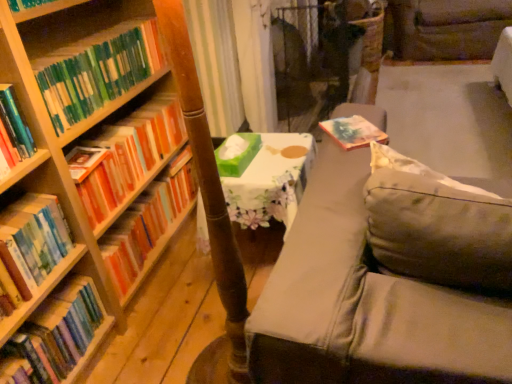
In order to face green matte tissue box at center, should I rotate leftwards or rightwards?

A 3.192 degree turn to the left will do.

What do you see at coordinates (86, 180) in the screenshot? Image resolution: width=512 pixels, height=384 pixels. I see `wooden bookcase at left` at bounding box center [86, 180].

What is the approximate height of orange matte bookshelf at left, which appears as the third book when ordered from the bottom?

25.70 centimeters.

Image resolution: width=512 pixels, height=384 pixels. In order to click on hardcover books at left, the fourth book when ordered from bottom to top in this screenshot , I will do `click(129, 154)`.

The image size is (512, 384). Describe the element at coordinates (365, 303) in the screenshot. I see `gray fabric couch at right` at that location.

I want to click on green matte tissue box at center, so click(x=237, y=155).

In the scene shown: Which object is positioned more to the left, gray fabric couch at right or green matte tissue box at center?

green matte tissue box at center.

Is gray fabric couch at right aimed at green matte tissue box at center?

No, gray fabric couch at right is not facing towards green matte tissue box at center.

From the image's perspective, is gray fabric couch at right under green matte tissue box at center?

Yes, from the image's perspective, gray fabric couch at right is beneath green matte tissue box at center.

In the image, is gray fabric couch at right positioned in front of or behind gray fabric swivel chair at upper right?

Visually, gray fabric couch at right is located in front of gray fabric swivel chair at upper right.

Image resolution: width=512 pixels, height=384 pixels. Find the location of `studio couch that appears above the gray fabric swivel chair at upper right (from a real-world perspective)`. studio couch that appears above the gray fabric swivel chair at upper right (from a real-world perspective) is located at coordinates (365, 303).

Is gray fabric couch at right beside gray fabric swivel chair at upper right?

There is a gap between gray fabric couch at right and gray fabric swivel chair at upper right.

Looking at this image, can gray fabric couch at right be found inside gray fabric swivel chair at upper right?

No, gray fabric couch at right is not a part of gray fabric swivel chair at upper right.

Considering the sizes of gray fabric swivel chair at upper right and gray fabric couch at right in the image, is gray fabric swivel chair at upper right taller or shorter than gray fabric couch at right?

In the image, gray fabric swivel chair at upper right appears to be shorter than gray fabric couch at right.

Which is in front, point (406, 14) or point (481, 356)?

Point (481, 356)

From the image's perspective, relative to hardcover books at left, the fourth book when ordered from bottom to top, is green matte tissue box at center above or below?

Based on their image positions, green matte tissue box at center is located beneath hardcover books at left, the fourth book when ordered from bottom to top.

How different are the orientations of green matte tissue box at center and hardcover books at left, which appears as the second book when viewed from the top, in degrees?

green matte tissue box at center and hardcover books at left, which appears as the second book when viewed from the top, are facing 87.9 degrees away from each other.

Which object is closer to the camera taking this photo, green matte tissue box at center or hardcover books at left, which appears as the second book when viewed from the top?

hardcover books at left, which appears as the second book when viewed from the top.

Is green matte tissue box at center inside or outside of hardcover books at left, which appears as the second book when viewed from the top?

green matte tissue box at center lies outside hardcover books at left, which appears as the second book when viewed from the top.

Looking at this image, can you confirm if orange matte bookshelf at left, the 3th book viewed from the top, is shorter than gray fabric couch at right?

Yes, orange matte bookshelf at left, the 3th book viewed from the top, is shorter than gray fabric couch at right.

How much distance is there between orange matte bookshelf at left, the 3th book viewed from the top, and gray fabric couch at right?

orange matte bookshelf at left, the 3th book viewed from the top, and gray fabric couch at right are 37.08 inches apart.

From a real-world perspective, which is physically above, orange matte bookshelf at left, which appears as the third book when ordered from the bottom, or gray fabric couch at right?

In real-world perspective, gray fabric couch at right is above.

Image resolution: width=512 pixels, height=384 pixels. What are the coordinates of `studio couch on the right of orange matte bookshelf at left, which appears as the third book when ordered from the bottom` in the screenshot? It's located at (365, 303).

Which point is more forward, (51, 96) or (465, 378)?

The point (465, 378) is more forward.

Image resolution: width=512 pixels, height=384 pixels. Find the location of `the 3rd book directly above the gray fabric couch at right (from a real-world perspective)`. the 3rd book directly above the gray fabric couch at right (from a real-world perspective) is located at coordinates [97, 70].

Can you confirm if green matte bookshelf at left, marked as the fifth book in a bottom-to-top arrangement, is positioned to the left of gray fabric couch at right?

Correct, you'll find green matte bookshelf at left, marked as the fifth book in a bottom-to-top arrangement, to the left of gray fabric couch at right.

What's the angular difference between green matte bookshelf at left, marked as the first book in a top-to-bottom arrangement, and gray fabric couch at right's facing directions?

They differ by 90.6 degrees in their facing directions.

Can you confirm if wooden bookcase at left is bigger than green matte tissue box at center?

Correct, wooden bookcase at left is larger in size than green matte tissue box at center.

Would you say wooden bookcase at left is a long distance from green matte tissue box at center?

wooden bookcase at left is near green matte tissue box at center, not far away.

Locate an element on the screen. This screenshot has height=384, width=512. paperback book behind the wooden bookcase at left is located at coordinates (237, 155).

Is the position of wooden bookcase at left less distant than that of green matte tissue box at center?

Yes, the depth of wooden bookcase at left is less than that of green matte tissue box at center.

Where is `studio couch lying on the right of green matte tissue box at center`? Image resolution: width=512 pixels, height=384 pixels. studio couch lying on the right of green matte tissue box at center is located at coordinates (365, 303).

This screenshot has height=384, width=512. Find the location of `studio couch that is in front of the gray fabric swivel chair at upper right`. studio couch that is in front of the gray fabric swivel chair at upper right is located at coordinates (365, 303).

Which object lies nearer to the anchor point hardcover books at left, the 1th book when ordered from bottom to top, green matte tissue box at center or hardcover books at left, the fourth book when ordered from bottom to top?

Based on the image, hardcover books at left, the fourth book when ordered from bottom to top, appears to be nearer to hardcover books at left, the 1th book when ordered from bottom to top.

Looking at the image, which one is located further to gray fabric swivel chair at upper right, hardcover books at left, arranged as the fifth book when viewed from the top, or green matte bookshelf at left, marked as the fifth book in a bottom-to-top arrangement?

hardcover books at left, arranged as the fifth book when viewed from the top, is positioned further to the anchor gray fabric swivel chair at upper right.

When comparing their distances from hardcover books at left, arranged as the fifth book when viewed from the top, does green matte bookshelf at left, marked as the first book in a top-to-bottom arrangement, or gray fabric couch at right seem closer?

green matte bookshelf at left, marked as the first book in a top-to-bottom arrangement, is positioned closer to the anchor hardcover books at left, arranged as the fifth book when viewed from the top.

Considering their positions, is hardcover books at left, which appears as the second book when viewed from the top, positioned further to green matte bookshelf at left, marked as the first book in a top-to-bottom arrangement, than hardcover books at left, arranged as the fifth book when viewed from the top?

hardcover books at left, arranged as the fifth book when viewed from the top, lies further to green matte bookshelf at left, marked as the first book in a top-to-bottom arrangement, than the other object.

Estimate the real-world distances between objects in this image. Which object is further from green matte bookshelf at left, marked as the fifth book in a bottom-to-top arrangement, orange matte bookshelf at left, which appears as the third book when ordered from the bottom, or gray fabric swivel chair at upper right?

Among the two, gray fabric swivel chair at upper right is located further to green matte bookshelf at left, marked as the fifth book in a bottom-to-top arrangement.

Considering their positions, is hardcover book at left, which ranks as the 4th book in top-to-bottom order, positioned further to orange matte bookshelf at left, the 3th book viewed from the top, than gray fabric couch at right?

The object further to orange matte bookshelf at left, the 3th book viewed from the top, is gray fabric couch at right.

Looking at the image, which one is located closer to wooden bookcase at left, hardcover books at left, which appears as the second book when viewed from the top, or green matte tissue box at center?

The object closer to wooden bookcase at left is hardcover books at left, which appears as the second book when viewed from the top.

Looking at the image, which one is located further to hardcover books at left, arranged as the fifth book when viewed from the top, hardcover book at left, the 2th book ordered from the bottom, or wooden bookcase at left?

Among the two, wooden bookcase at left is located further to hardcover books at left, arranged as the fifth book when viewed from the top.

You are a GUI agent. You are given a task and a screenshot of the screen. Output one action in this format:
    pyautogui.click(x=<x>, y=<y>)
    Task: Click on the bookcase that lies between green matte bookshelf at left, marked as the fifth book in a bottom-to-top arrangement, and hardcover books at left, arranged as the fifth book when viewed from the top, from top to bottom
    
    Given the screenshot: What is the action you would take?
    pyautogui.click(x=86, y=180)

Find the location of a particular element. book between hardcover books at left, the fourth book when ordered from bottom to top, and gray fabric swivel chair at upper right, in the horizontal direction is located at coordinates (147, 223).

The image size is (512, 384). Identify the location of bookcase situated between hardcover book at left, which ranks as the 4th book in top-to-bottom order, and gray fabric couch at right from left to right. (86, 180).

Locate an element on the screen. This screenshot has height=384, width=512. paperback book located between wooden bookcase at left and gray fabric swivel chair at upper right in the depth direction is located at coordinates (237, 155).